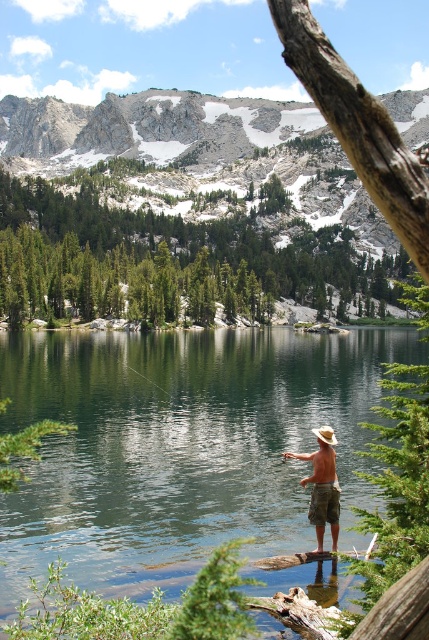
Which is more to the left, green textured pine trees at upper center or tan canvas hat at center?

Positioned to the left is green textured pine trees at upper center.

Who is positioned more to the right, green textured pine trees at upper center or tan canvas hat at center?

From the viewer's perspective, tan canvas hat at center appears more on the right side.

Find the location of a particular element. green textured pine trees at upper center is located at coordinates (166, 260).

Image resolution: width=429 pixels, height=640 pixels. Identify the location of green textured pine trees at upper center. (166, 260).

Does clear water at center appear on the right side of tan canvas hat at center?

Incorrect, clear water at center is not on the right side of tan canvas hat at center.

Is clear water at center smaller than tan canvas hat at center?

No, clear water at center is not smaller than tan canvas hat at center.

Between point (181, 451) and point (325, 524), which one is positioned in front?

Point (325, 524)

Where is `clear water at center`? The height and width of the screenshot is (640, 429). clear water at center is located at coordinates (180, 448).

Is clear water at center taller than green textured pine trees at upper center?

Incorrect, clear water at center's height is not larger of green textured pine trees at upper center's.

Which is more to the right, clear water at center or green textured pine trees at upper center?

green textured pine trees at upper center

Between point (325, 577) and point (71, 248), which one is positioned behind?

The point (71, 248) is more distant.

Identify the location of clear water at center. This screenshot has height=640, width=429. (180, 448).